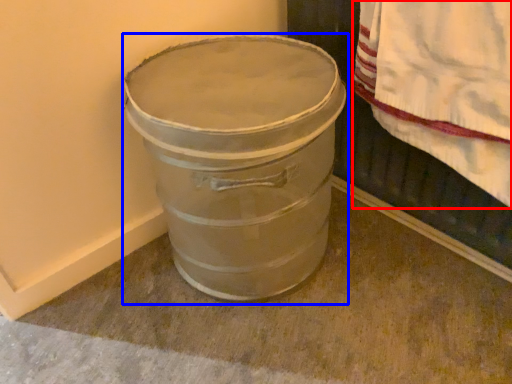
Question: Which object is further to the camera taking this photo, blanket (highlighted by a red box) or waste container (highlighted by a blue box)?

Choices:
 (A) blanket
 (B) waste container

Answer: (B)